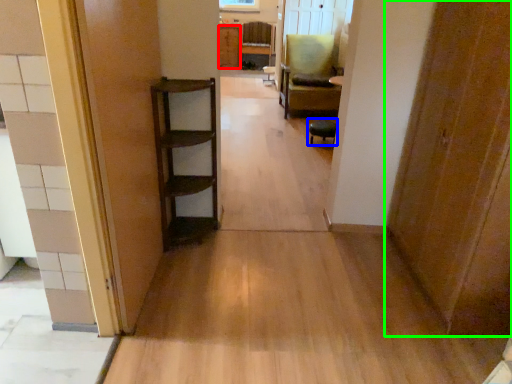
Question: Which is nearer to the cabinetry (highlighted by a red box)? furniture (highlighted by a blue box) or door (highlighted by a green box).

Choices:
 (A) furniture
 (B) door

Answer: (A)